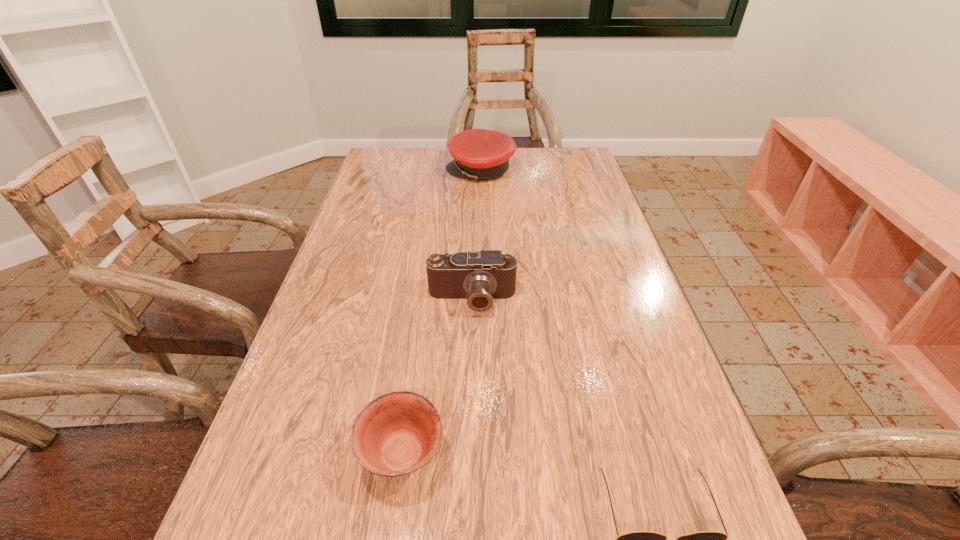
This screenshot has height=540, width=960. I want to click on free space at the left edge, so click(353, 219).

Identify the location of vacant region at the right edge of the desktop. This screenshot has width=960, height=540. (608, 328).

Locate an element on the screen. Image resolution: width=960 pixels, height=540 pixels. vacant space at the far right corner of the desktop is located at coordinates point(585,157).

The width and height of the screenshot is (960, 540). I want to click on free space between the camera and the third tallest object, so click(x=437, y=377).

You are a GUI agent. You are given a task and a screenshot of the screen. Output one action in this format:
    pyautogui.click(x=<x>, y=<y>)
    Task: Click on the free point between the bowl and the second farthest object
    Image resolution: width=960 pixels, height=540 pixels.
    Given the screenshot: What is the action you would take?
    pyautogui.click(x=437, y=377)

You are a GUI agent. You are given a task and a screenshot of the screen. Output one action in this format:
    pyautogui.click(x=<x>, y=<y>)
    Task: Click on the object that can be found as the second closest to the rightmost object
    The height and width of the screenshot is (540, 960).
    Given the screenshot: What is the action you would take?
    pyautogui.click(x=479, y=277)

The height and width of the screenshot is (540, 960). I want to click on object that ranks as the closest to the rightmost object, so click(397, 433).

The height and width of the screenshot is (540, 960). I want to click on free space in the image that satisfies the following two spatial constraints: 1. on the front of the farthest object with an emblem; 2. on the front-facing side of the third nearest object, so click(x=481, y=300).

You are a GUI agent. You are given a task and a screenshot of the screen. Output one action in this format:
    pyautogui.click(x=<x>, y=<y>)
    Task: Click on the free spot that satisfies the following two spatial constraints: 1. on the front of the cap with an emblem; 2. on the front side of the second shortest object
    Image resolution: width=960 pixels, height=540 pixels.
    Given the screenshot: What is the action you would take?
    pyautogui.click(x=481, y=454)

You are a GUI agent. You are given a task and a screenshot of the screen. Output one action in this format:
    pyautogui.click(x=<x>, y=<y>)
    Task: Click on the vacant region that satisfies the following two spatial constraints: 1. on the front of the cap with an emblem; 2. on the front-facing side of the third nearest object
    Image resolution: width=960 pixels, height=540 pixels.
    Given the screenshot: What is the action you would take?
    pyautogui.click(x=481, y=300)